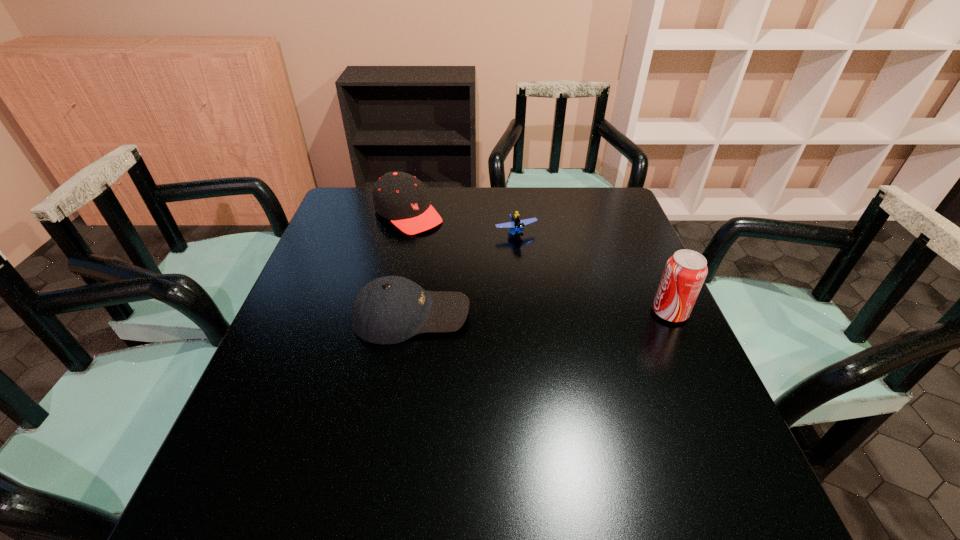
In order to click on blank area located 0.360m on the front-facing side of the cap in this screenshot , I will do `click(509, 294)`.

Identify the location of vacant space located on the front-facing side of the cap. (440, 240).

This screenshot has height=540, width=960. I want to click on vacant space positioned on the front-facing side of the cap, so click(478, 271).

Image resolution: width=960 pixels, height=540 pixels. Identify the location of blank space located 0.240m on the front-facing side of the shortest object. (558, 298).

Where is `vacant space located on the front-facing side of the shortest object`? This screenshot has width=960, height=540. vacant space located on the front-facing side of the shortest object is located at coordinates (576, 327).

I want to click on free region located 0.240m on the front-facing side of the shortest object, so click(x=558, y=298).

At what (x,y) coordinates should I click in order to perform the action: click on cap that is at the far edge. Please return your answer as a coordinate pair (x, y). Looking at the image, I should click on [400, 197].

Image resolution: width=960 pixels, height=540 pixels. Find the location of `Lego located in the far edge section of the desktop`. Lego located in the far edge section of the desktop is located at coordinates (516, 225).

The height and width of the screenshot is (540, 960). In order to click on baseball cap present at the left edge in this screenshot , I will do `click(389, 310)`.

Locate an element on the screen. cap that is at the left edge is located at coordinates (400, 197).